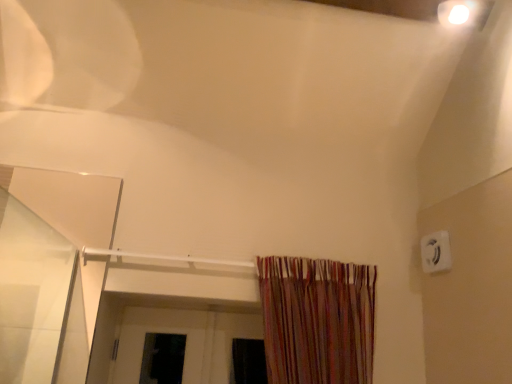
Question: Should I look upward or downward to see white plastic electric outlet at upper right?

Choices:
 (A) down
 (B) up

Answer: (A)